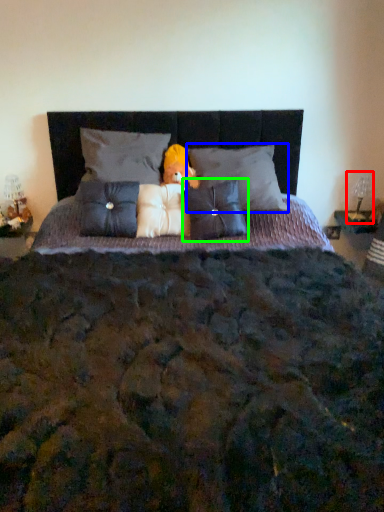
Question: Which is farther away from table lamp (highlighted by a red box)? pillow (highlighted by a blue box) or pillow (highlighted by a green box)?

Choices:
 (A) pillow
 (B) pillow

Answer: (B)